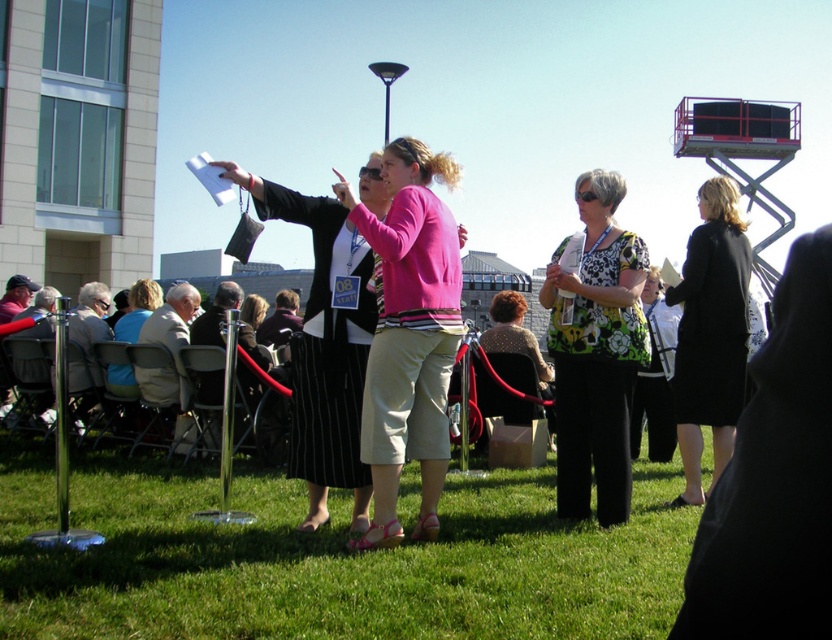
Question: Which of these objects is positioned farthest from the floral print blouse at center?

Choices:
 (A) black coat at center
 (B) pink fabric shirt at center

Answer: (B)

Question: Estimate the real-world distances between objects in this image. Which object is farther from the green grass at center?

Choices:
 (A) light brown wooden chairs at lower left
 (B) black coat at center

Answer: (A)

Question: Does green grass at center have a lesser width compared to black coat at center?

Choices:
 (A) yes
 (B) no

Answer: (B)

Question: Is floral print blouse at center behind light brown wooden chairs at lower left?

Choices:
 (A) yes
 (B) no

Answer: (B)

Question: Is green grass at center above light brown wooden chairs at lower left?

Choices:
 (A) yes
 (B) no

Answer: (B)

Question: Which point is closer to the camera?

Choices:
 (A) (608, 460)
 (B) (226, 605)
 (C) (87, 340)

Answer: (B)